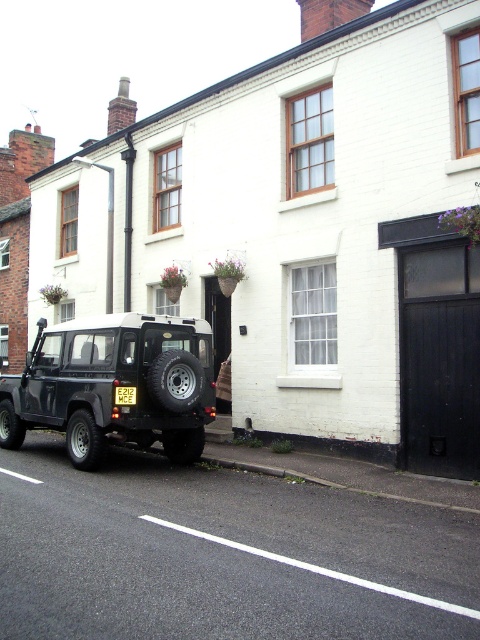
From the picture: Who is lower down, matte black jeep at lower left or yellow plastic license plate at center?

matte black jeep at lower left is lower down.

In order to click on matte black jeep at lower left in this screenshot , I will do `click(113, 385)`.